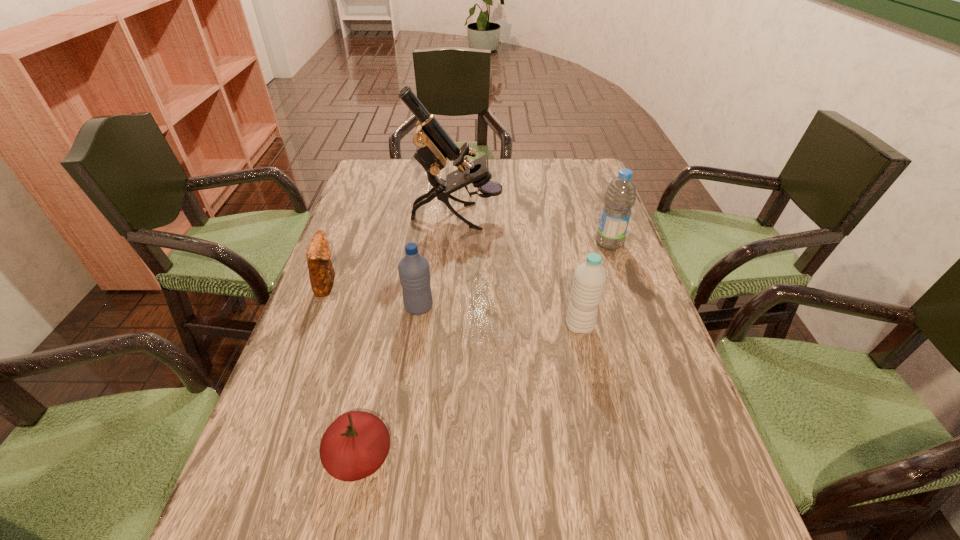
I want to click on vacant area situated through the eyepiece of the microscope, so click(x=561, y=217).

The width and height of the screenshot is (960, 540). What are the coordinates of `vacant area located 0.350m on the back of the rightmost object` in the screenshot? It's located at (585, 174).

Find the location of a particular element. This screenshot has width=960, height=540. vacant region located on the left of the second water bottle from left to right is located at coordinates click(x=513, y=327).

Where is `vacant space located on the left of the leftmost water bottle`? vacant space located on the left of the leftmost water bottle is located at coordinates (358, 307).

I want to click on free space located on the open side of the second shortest object, so pos(448,284).

Locate an element on the screen. Image resolution: width=960 pixels, height=540 pixels. vacant region located 0.100m on the back of the tomato is located at coordinates 375,382.

The height and width of the screenshot is (540, 960). What are the coordinates of `clutch bag at the left edge` in the screenshot? It's located at (321, 272).

Find the location of a particular element. The image size is (960, 540). tomato located in the left edge section of the desktop is located at coordinates (356, 444).

This screenshot has width=960, height=540. In the image, there is a desktop. Find the location of `vacant space at the far edge`. vacant space at the far edge is located at coordinates (530, 192).

In the image, there is a desktop. Identify the location of free region at the left edge. Image resolution: width=960 pixels, height=540 pixels. (271, 442).